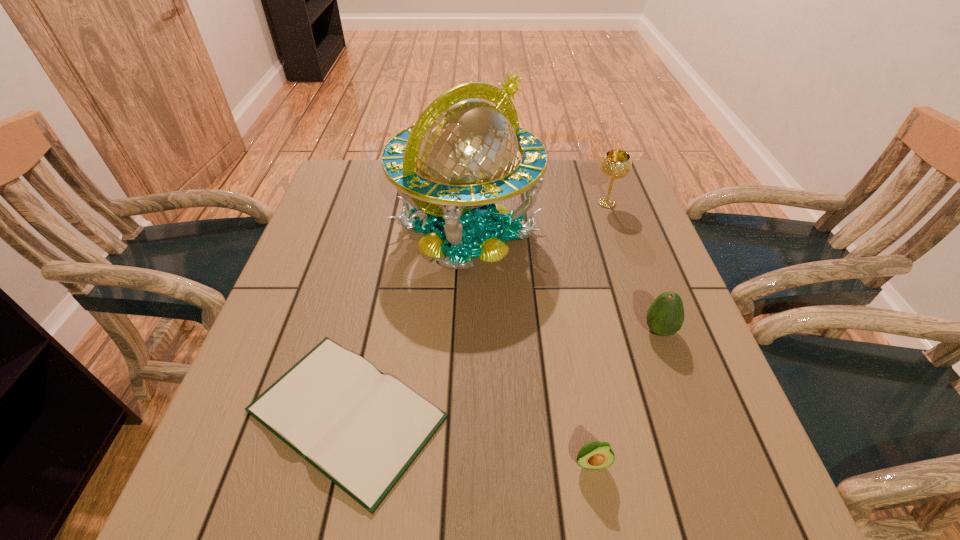
Find the location of a particular element. The width and height of the screenshot is (960, 540). object situated at the far right corner is located at coordinates (615, 164).

Where is `free space at the near edge of the desktop`? The image size is (960, 540). free space at the near edge of the desktop is located at coordinates (576, 477).

What are the coordinates of `vacant space at the left edge of the desktop` in the screenshot? It's located at (283, 366).

What are the coordinates of `free space at the right edge of the desktop` in the screenshot? It's located at (654, 348).

At what (x,y) coordinates should I click in order to perform the action: click on vacant space at the far left corner of the desktop. Please return your answer as a coordinate pair (x, y). Looking at the image, I should click on (353, 204).

The image size is (960, 540). Find the location of `vacant space at the far right corner`. vacant space at the far right corner is located at coordinates (605, 190).

You are a GUI agent. You are given a task and a screenshot of the screen. Output one action in this format:
    pyautogui.click(x=<x>, y=<y>)
    Task: Click on the empty space between the tallest object and the shortest object
    
    Given the screenshot: What is the action you would take?
    pyautogui.click(x=407, y=322)

Image resolution: width=960 pixels, height=540 pixels. What are the coordinates of `free spot between the shortest object and the second tallest object` in the screenshot? It's located at (477, 308).

Locate an element on the screen. The width and height of the screenshot is (960, 540). free space between the tallest object and the left avocado is located at coordinates (529, 347).

Locate an element on the screen. vacant region between the chalice and the second shortest object is located at coordinates (599, 333).